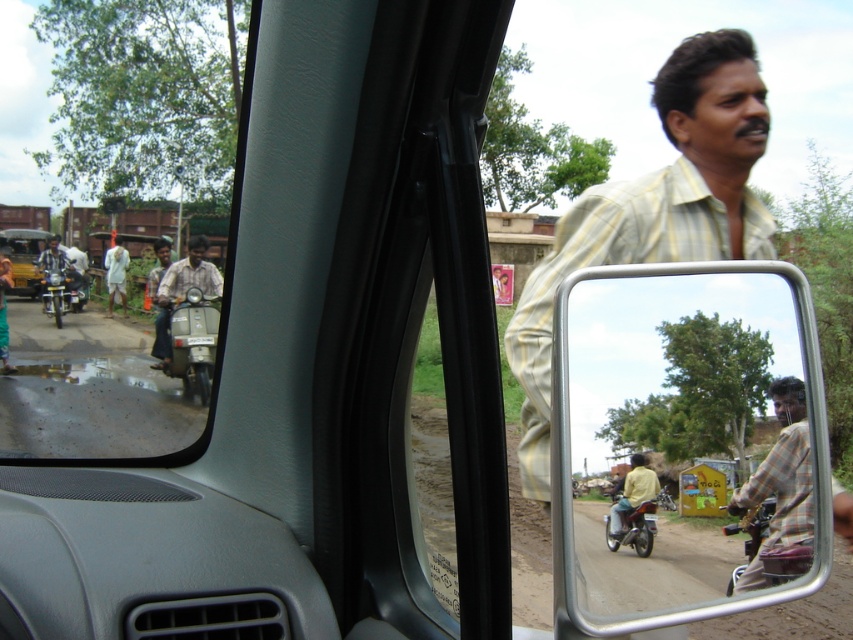
In the scene shown: You are a passenger in the car and looking at the metallic silver motorcycle at left and the white cotton shirt at left through the rearview mirror. Which object is closer to the left edge of the mirror?

A: The metallic silver motorcycle at left is closer to the left edge of the mirror because it is positioned to the left of the white cotton shirt at left.

You are a passenger in the car and notice two objects at the left side of the scene. The metallic silver motorcycle at left and the white cotton shirt at left. Which object is nearer to you?

The metallic silver motorcycle at left is closer to the viewer than the white cotton shirt at left, so the motorcycle is nearer.